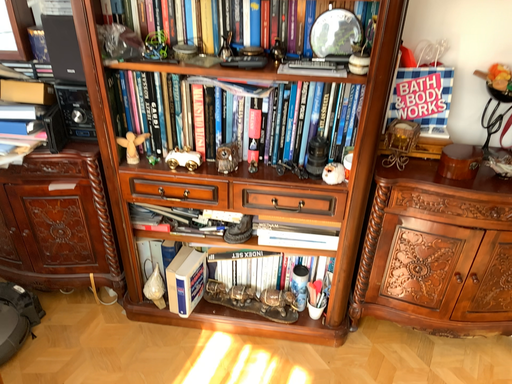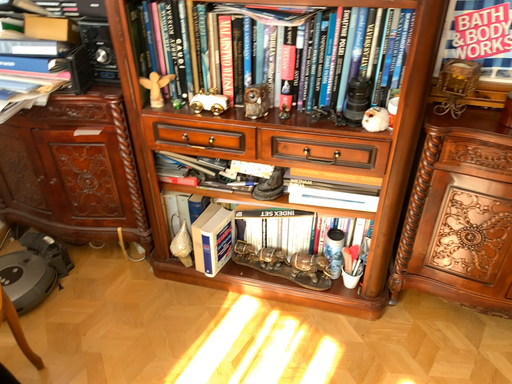
Question: Which way did the camera rotate in the video?

Choices:
 (A) rotated left
 (B) rotated right

Answer: (A)